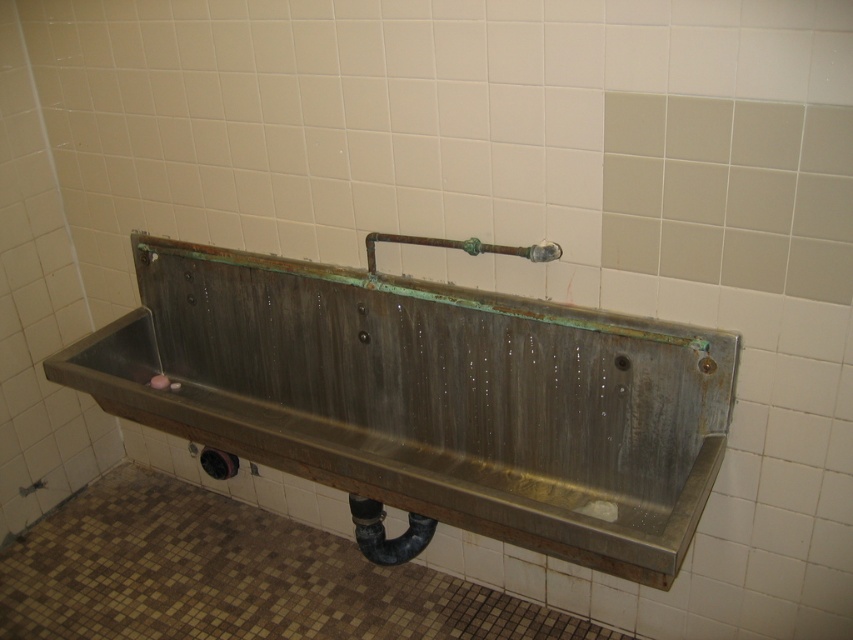
You are a plumber inspecting the restroom facilities. You notice the stainless steel sink at center and the green patina faucet at center. Which object would require more material to replace, considering their sizes?

The stainless steel sink at center has a larger size compared to the green patina faucet at center, so it would require more material to replace.

Where is the stainless steel sink at center located in the image?

The stainless steel sink at center is located at point (427,401) in the image.

You are a plumber inspecting the restroom and need to replace a part. You see the stainless steel sink at center and the green patina faucet at center. Which object is taller?

The stainless steel sink at center is much taller than the green patina faucet at center.